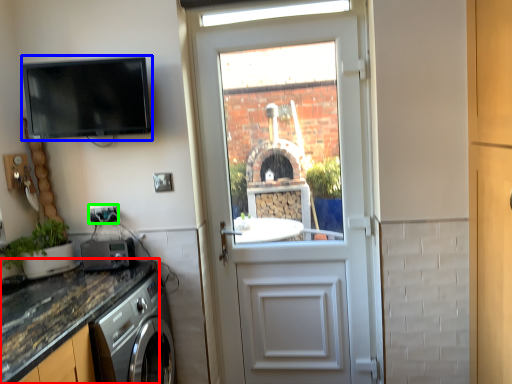
Question: Which object is the closest to the countertop (highlighted by a red box)? Choose among these: appliance (highlighted by a blue box) or electric outlet (highlighted by a green box).

Choices:
 (A) appliance
 (B) electric outlet

Answer: (B)